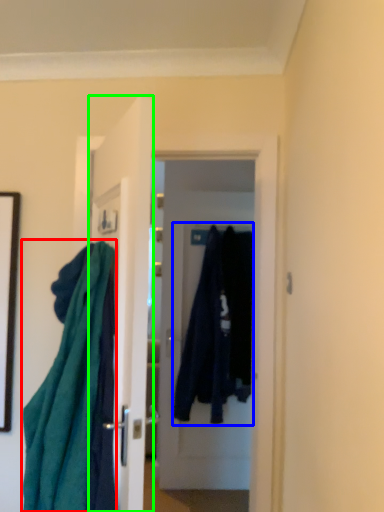
Question: Based on their relative distances, which object is farther from cloth (highlighted by a red box)? Choose from clothing (highlighted by a blue box) and door (highlighted by a green box).

Choices:
 (A) clothing
 (B) door

Answer: (A)